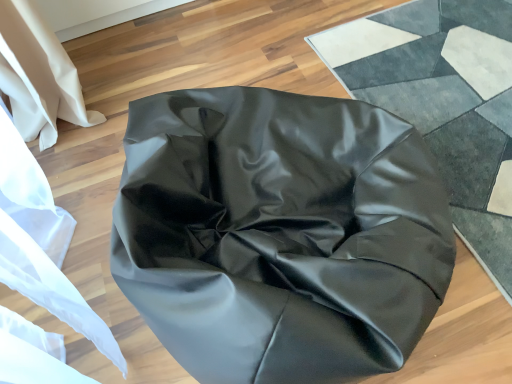
What is the approximate height of matte black bean bag at center?

It is 26.67 inches.

Measure the distance between point (318, 251) and camera.

They are 35.79 inches apart.

Where is `matte black bean bag at center`? The width and height of the screenshot is (512, 384). matte black bean bag at center is located at coordinates (279, 234).

Describe the element at coordinates (279, 234) in the screenshot. I see `matte black bean bag at center` at that location.

I want to click on matte black bean bag at center, so click(279, 234).